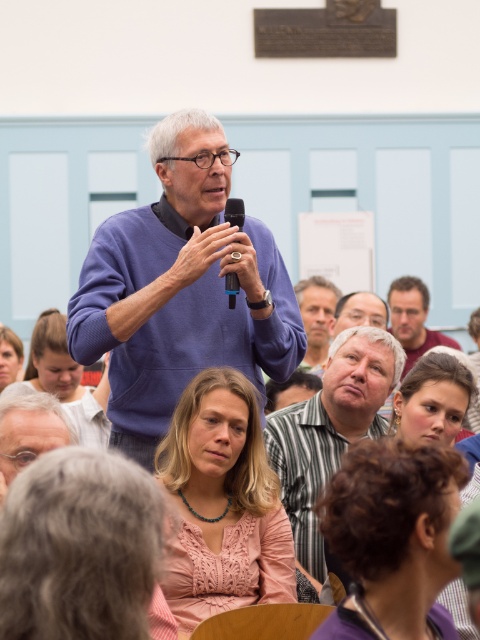
Can you confirm if striped shirt at center is thinner than matte pink sweater at center?

Indeed, striped shirt at center has a lesser width compared to matte pink sweater at center.

Is striped shirt at center smaller than matte pink sweater at center?

Correct, striped shirt at center occupies less space than matte pink sweater at center.

Between point (352, 436) and point (57, 376), which one is positioned behind?

Positioned behind is point (57, 376).

I want to click on striped shirt at center, so click(x=330, y=429).

Identify the location of matte pink sweater at center. The height and width of the screenshot is (640, 480). (64, 381).

Where is `matte pink sweater at center`? The width and height of the screenshot is (480, 640). matte pink sweater at center is located at coordinates (64, 381).

Can you confirm if light brown hair at center is positioned to the right of matte gray hair at center?

Incorrect, light brown hair at center is not on the right side of matte gray hair at center.

Does point (307, 355) lie in front of point (384, 321)?

No, it is behind (384, 321).

Is point (310, 323) positioned before point (371, 324)?

No.

The height and width of the screenshot is (640, 480). I want to click on light brown hair at center, so click(315, 316).